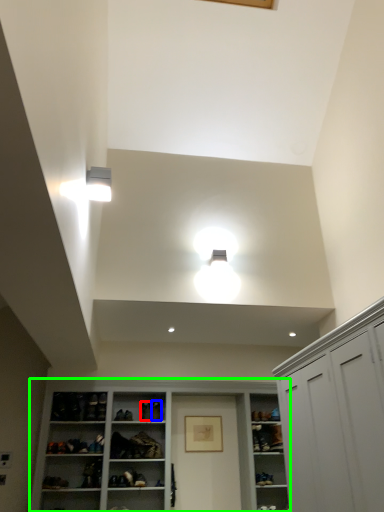
Question: Which object is the farthest from shoe (highlighted by a red box)? Choose among these: shoe (highlighted by a blue box) or cupboard (highlighted by a green box).

Choices:
 (A) shoe
 (B) cupboard

Answer: (B)